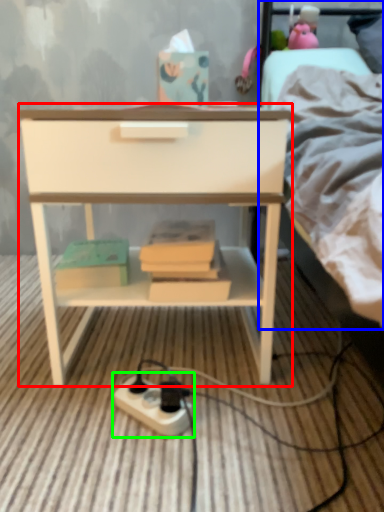
Question: Considering the real-world distances, which object is closest to nightstand (highlighted by a red box)? bed (highlighted by a blue box) or power plugs and sockets (highlighted by a green box).

Choices:
 (A) bed
 (B) power plugs and sockets

Answer: (A)